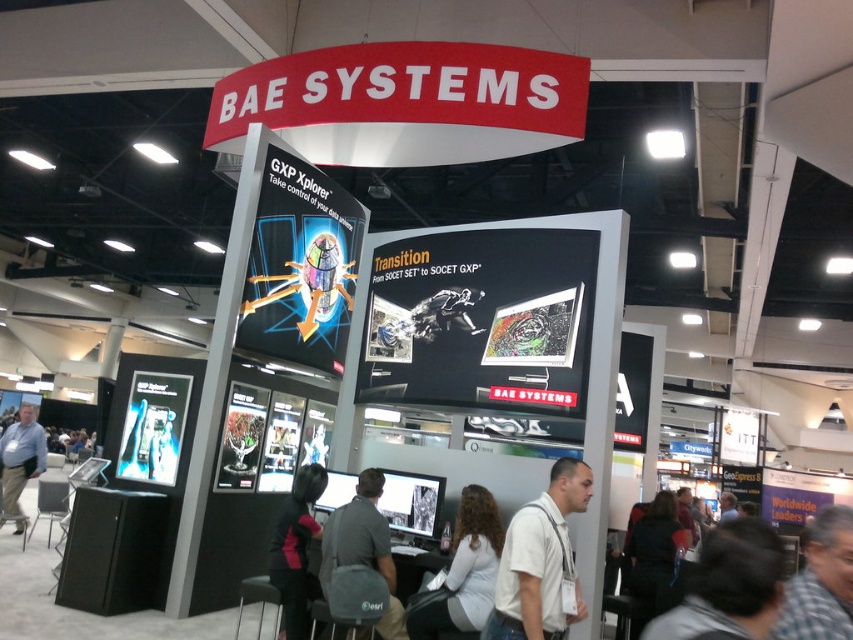
Can you confirm if gray fabric shirt at lower right is taller than light gray sweater at center?

No.

Between gray fabric shirt at lower right and light gray sweater at center, which one is positioned lower?

light gray sweater at center is below.

You are a GUI agent. You are given a task and a screenshot of the screen. Output one action in this format:
    pyautogui.click(x=<x>, y=<y>)
    Task: Click on the gray fabric shirt at lower right
    The image size is (853, 640).
    Given the screenshot: What is the action you would take?
    pyautogui.click(x=729, y=586)

Is white cotton shirt at center to the left of black fabric shirt at lower center from the viewer's perspective?

Incorrect, white cotton shirt at center is not on the left side of black fabric shirt at lower center.

Which is above, white cotton shirt at center or black fabric shirt at lower center?

white cotton shirt at center

Which is behind, point (515, 616) or point (310, 500)?

Point (310, 500)

What are the coordinates of `white cotton shirt at center` in the screenshot? It's located at (540, 561).

Can you confirm if plaid shirt at lower right is smaller than black fabric shirt at lower center?

Indeed, plaid shirt at lower right has a smaller size compared to black fabric shirt at lower center.

Describe the element at coordinates (821, 580) in the screenshot. The image size is (853, 640). I see `plaid shirt at lower right` at that location.

You are a GUI agent. You are given a task and a screenshot of the screen. Output one action in this format:
    pyautogui.click(x=<x>, y=<y>)
    Task: Click on the plaid shirt at lower right
    
    Given the screenshot: What is the action you would take?
    pyautogui.click(x=821, y=580)